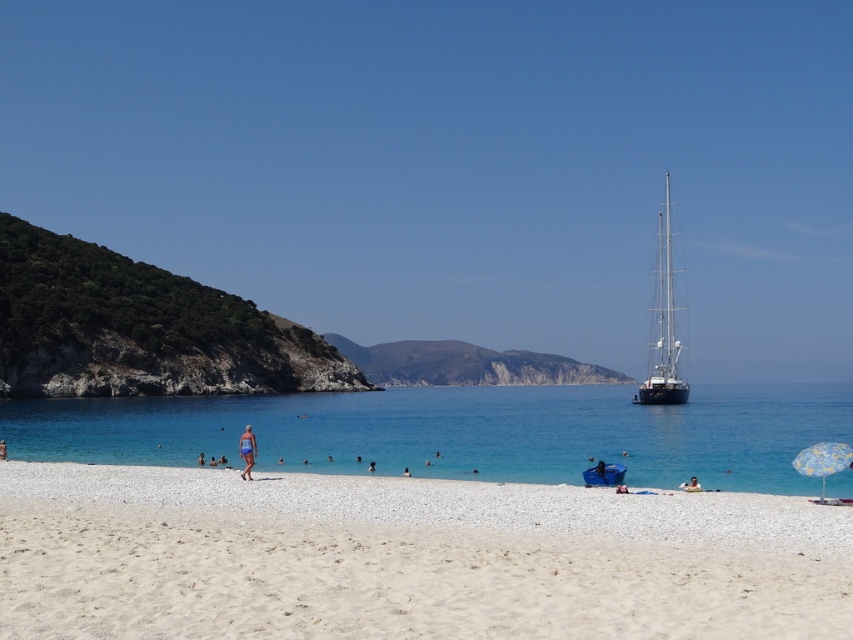
Question: Does white sandy beach at lower center come behind shiny silver sailboat at right?

Choices:
 (A) no
 (B) yes

Answer: (A)

Question: Which point is closer to the camera?

Choices:
 (A) white sandy beach at lower center
 (B) yellow floral fabric umbrella at lower right
 (C) shiny silver sailboat at right
 (D) blue fabric swimsuit at center

Answer: (A)

Question: Is light blue swimsuit at lower center in front of blue fabric towel at lower center?

Choices:
 (A) yes
 (B) no

Answer: (A)

Question: Does blue matte surfboard at lower center have a greater width compared to blue fabric swimsuit at center?

Choices:
 (A) yes
 (B) no

Answer: (A)

Question: Among these objects, which one is farthest from the camera?

Choices:
 (A) shiny silver sailboat at right
 (B) clear blue water at center
 (C) blue fabric person at lower center
 (D) yellow floral fabric umbrella at lower right

Answer: (A)

Question: Based on their relative distances, which object is farther from the yellow floral fabric umbrella at lower right?

Choices:
 (A) white sandy beach at lower center
 (B) blue fabric towel at lower center
 (C) light blue swimsuit at lower center
 (D) blue matte surfboard at lower center

Answer: (B)